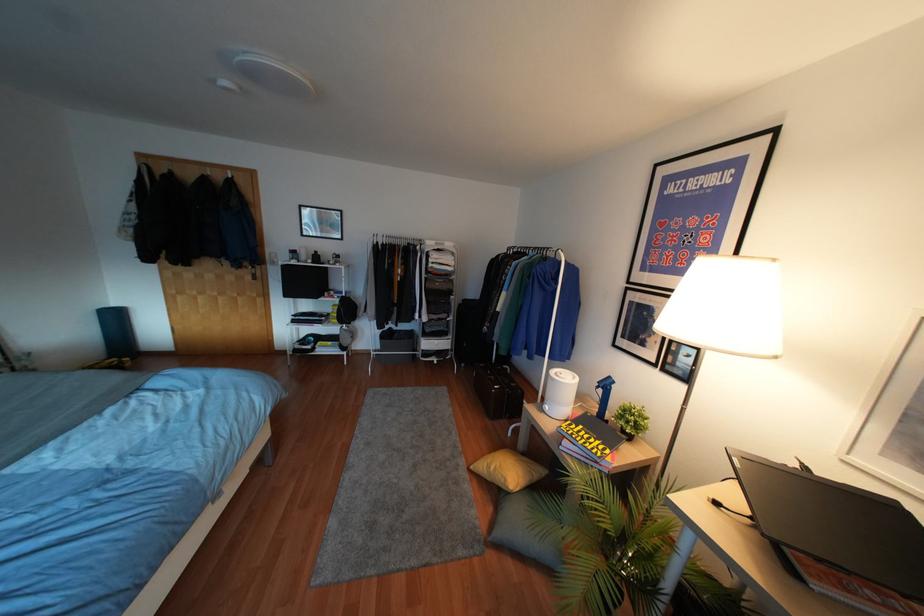
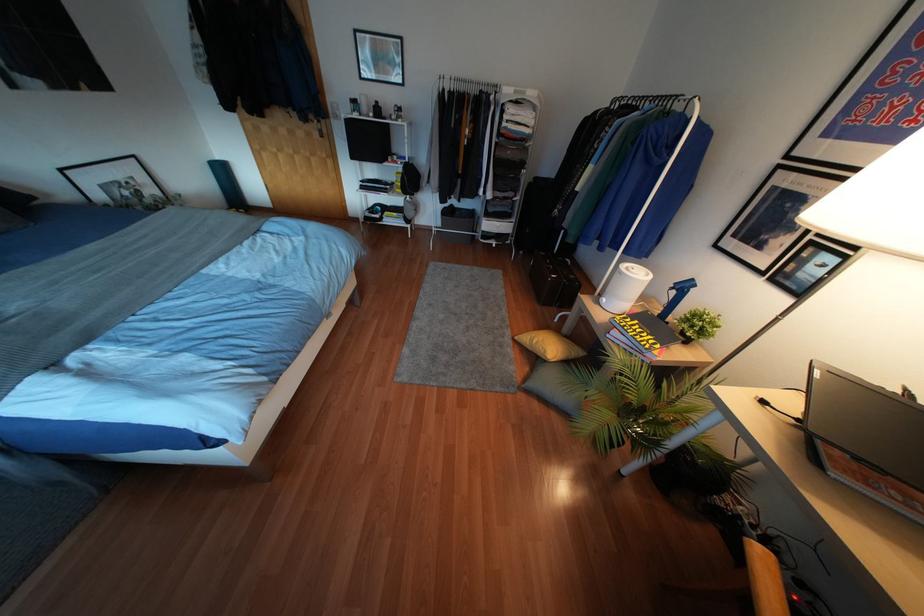
The point at (513, 384) is marked in the first image. Where is the corresponding point in the second image?

(572, 277)